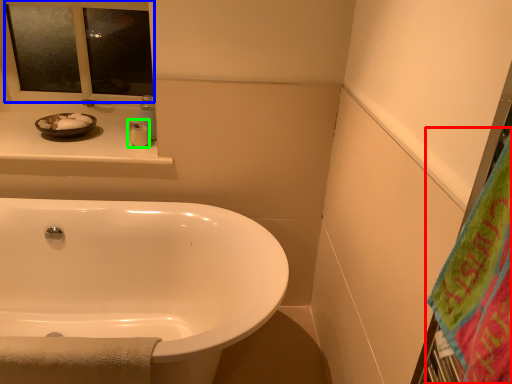
Question: Which is farther away from beach towel (highlighted by a red box)? mirror (highlighted by a blue box) or toiletry (highlighted by a green box)?

Choices:
 (A) mirror
 (B) toiletry

Answer: (A)